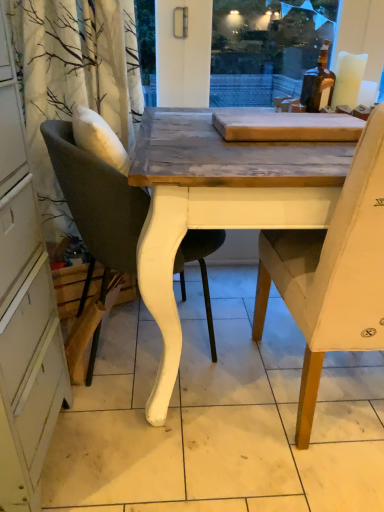
Where is `vacant area that lies between matte gray cushioned chair at left, the first chair when ordered from left to right, and light beige fabric chair at right, which is the first chair from right to left`? This screenshot has height=512, width=384. vacant area that lies between matte gray cushioned chair at left, the first chair when ordered from left to right, and light beige fabric chair at right, which is the first chair from right to left is located at coordinates (200, 409).